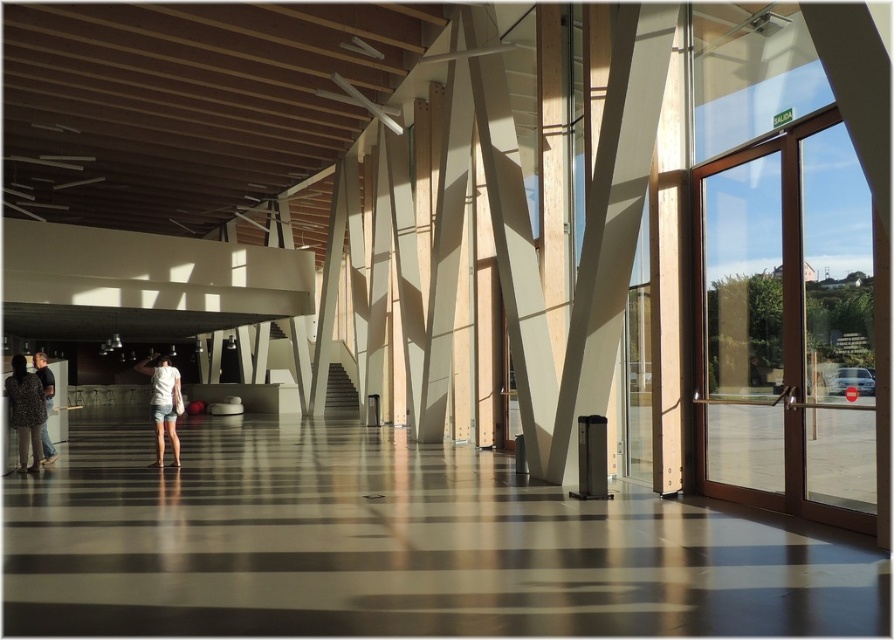
How far apart are glossy polished concrete floor at center and clear glass door at right?

glossy polished concrete floor at center and clear glass door at right are 2.76 meters apart.

Can you confirm if glossy polished concrete floor at center is taller than clear glass door at right?

In fact, glossy polished concrete floor at center may be shorter than clear glass door at right.

Find the location of a particular element. The width and height of the screenshot is (894, 640). glossy polished concrete floor at center is located at coordinates (395, 547).

Is point (685, 595) closer to camera compared to point (154, 464)?

Yes.

Can you confirm if glossy polished concrete floor at center is taller than white cotton shirt at center?

In fact, glossy polished concrete floor at center may be shorter than white cotton shirt at center.

Between point (395, 476) and point (158, 467), which one is positioned behind?

Positioned behind is point (158, 467).

The height and width of the screenshot is (640, 894). Identify the location of glossy polished concrete floor at center. (395, 547).

Which is more to the left, patterned fabric dress at lower left or leather jacket at left?

Positioned to the left is leather jacket at left.

Is patterned fabric dress at lower left taller than leather jacket at left?

Yes, patterned fabric dress at lower left is taller than leather jacket at left.

Which is behind, point (18, 417) or point (49, 376)?

The point (49, 376) is more distant.

This screenshot has height=640, width=894. I want to click on patterned fabric dress at lower left, so click(x=24, y=412).